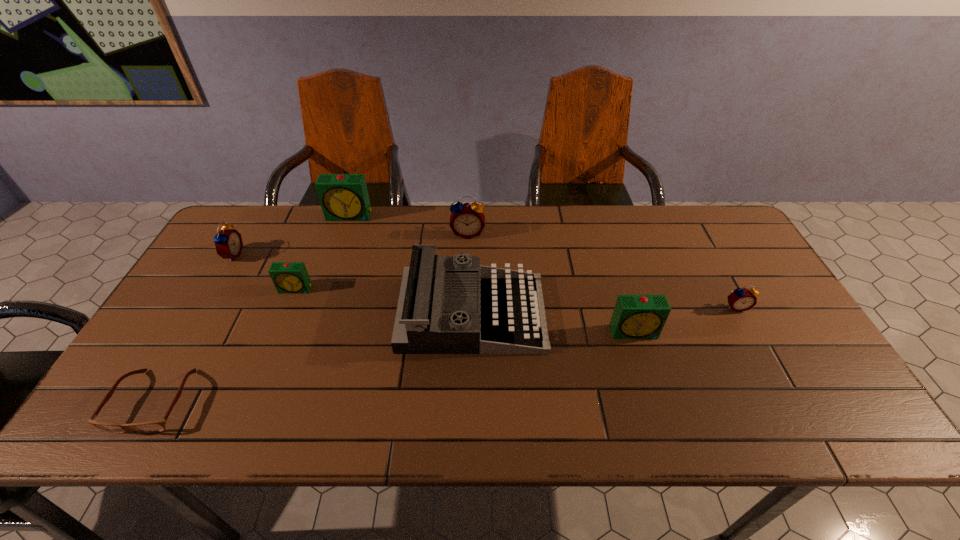
Identify the location of vacant space located on the front-facing side of the rightmost red alarm clock. The height and width of the screenshot is (540, 960). (770, 369).

The height and width of the screenshot is (540, 960). I want to click on vacant space located 0.220m on the front-facing side of the smallest green alarm clock, so click(x=267, y=360).

Find the location of `object positioned at the near edge`. object positioned at the near edge is located at coordinates (154, 426).

Find the location of a particular element. The image size is (960, 540). alarm clock that is at the left edge is located at coordinates (228, 242).

This screenshot has width=960, height=540. I want to click on spectacles present at the left edge, so click(154, 426).

Find the location of a particular element. This screenshot has height=540, width=960. object that is at the right edge is located at coordinates (741, 299).

Locate an element on the screen. Image resolution: width=960 pixels, height=540 pixels. object that is positioned at the far left corner is located at coordinates (228, 242).

This screenshot has height=540, width=960. I want to click on object that is at the near left corner, so click(x=154, y=426).

Find the location of `free spot at the far edge of the desktop`. free spot at the far edge of the desktop is located at coordinates (442, 212).

Image resolution: width=960 pixels, height=540 pixels. I want to click on vacant space at the near edge of the desktop, so click(x=340, y=420).